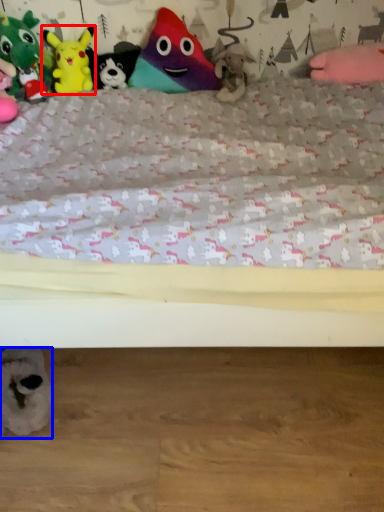
Question: Which point is closer to the camera, toy (highlighted by a red box) or toy (highlighted by a blue box)?

Choices:
 (A) toy
 (B) toy

Answer: (B)